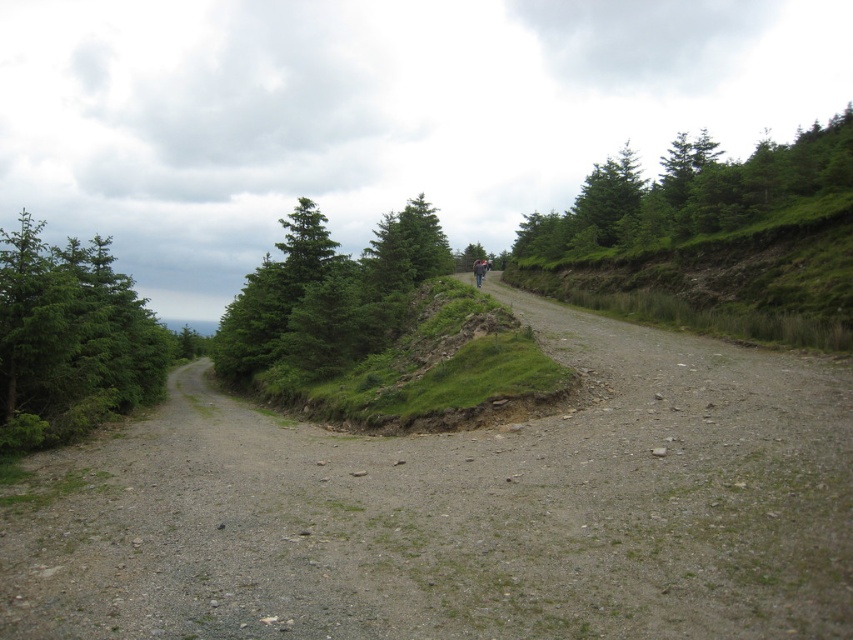
Question: Which point is farther to the camera?

Choices:
 (A) dull gray gravel road at left
 (B) green leafy trees at upper right
 (C) green leafy trees at center

Answer: (B)

Question: Estimate the real-world distances between objects in this image. Which object is farther from the green textured tree at left?

Choices:
 (A) green leafy trees at center
 (B) dark blue fabric mountain biker at center
 (C) dull gray gravel road at left

Answer: (B)

Question: Does dull gray gravel road at left lie behind green leafy trees at center?

Choices:
 (A) no
 (B) yes

Answer: (A)

Question: Which object is positioned closest to the green leafy trees at upper right?

Choices:
 (A) dull gray gravel road at left
 (B) dark blue fabric mountain biker at center

Answer: (A)

Question: Is dull gray gravel road at left positioned at the back of green leafy trees at upper right?

Choices:
 (A) yes
 (B) no

Answer: (B)

Question: Where is dull gray gravel road at left located in relation to green textured tree at left in the image?

Choices:
 (A) above
 (B) below

Answer: (B)